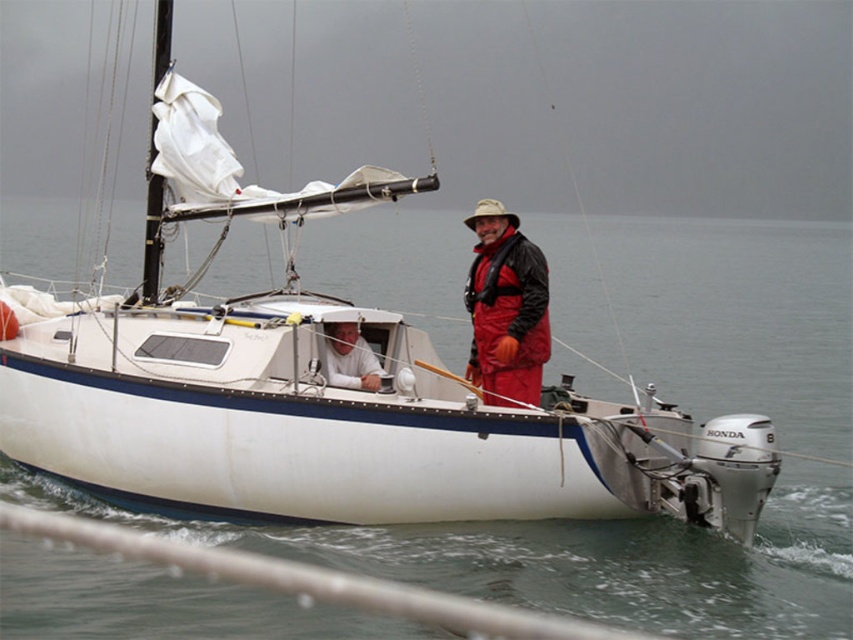
Question: Can you confirm if clear water at boat center is positioned to the right of red waterproof suit at center?

Choices:
 (A) yes
 (B) no

Answer: (B)

Question: Where is red waterproof suit at center located in relation to white matte shirt at center in the image?

Choices:
 (A) left
 (B) right

Answer: (B)

Question: Is clear water at boat center above white matte shirt at center?

Choices:
 (A) no
 (B) yes

Answer: (B)

Question: Estimate the real-world distances between objects in this image. Which object is farther from the clear water at boat center?

Choices:
 (A) white matte shirt at center
 (B) white sail at upper left

Answer: (B)

Question: Estimate the real-world distances between objects in this image. Which object is closer to the white sail at upper left?

Choices:
 (A) white matte shirt at center
 (B) red waterproof suit at center
 (C) clear water at boat center

Answer: (A)

Question: Which of the following is the closest to the observer?

Choices:
 (A) clear water at boat center
 (B) white sail at upper left
 (C) red waterproof suit at center
 (D) white matte shirt at center

Answer: (A)